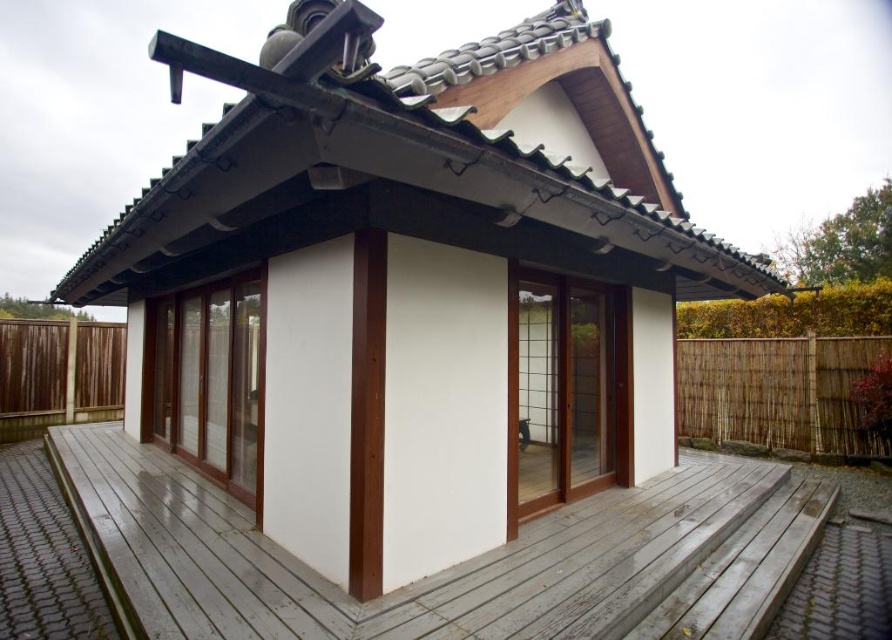
Between shiny black tiles at upper center and smooth wooden deck at center, which one is positioned lower?

smooth wooden deck at center is lower down.

Can you confirm if shiny black tiles at upper center is thinner than smooth wooden deck at center?

No, shiny black tiles at upper center is not thinner than smooth wooden deck at center.

Describe the element at coordinates (411, 163) in the screenshot. I see `shiny black tiles at upper center` at that location.

Locate an element on the screen. The height and width of the screenshot is (640, 892). shiny black tiles at upper center is located at coordinates (411, 163).